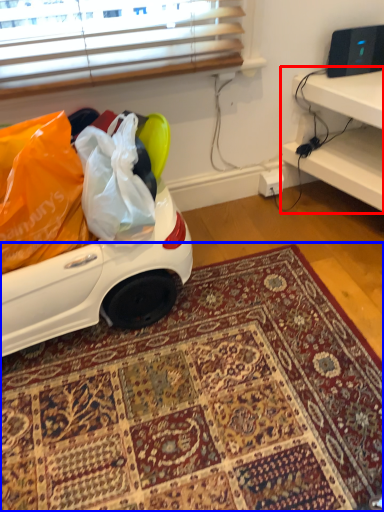
Question: Which of the following is the farthest to the observer, furniture (highlighted by a red box) or mat (highlighted by a blue box)?

Choices:
 (A) furniture
 (B) mat

Answer: (A)